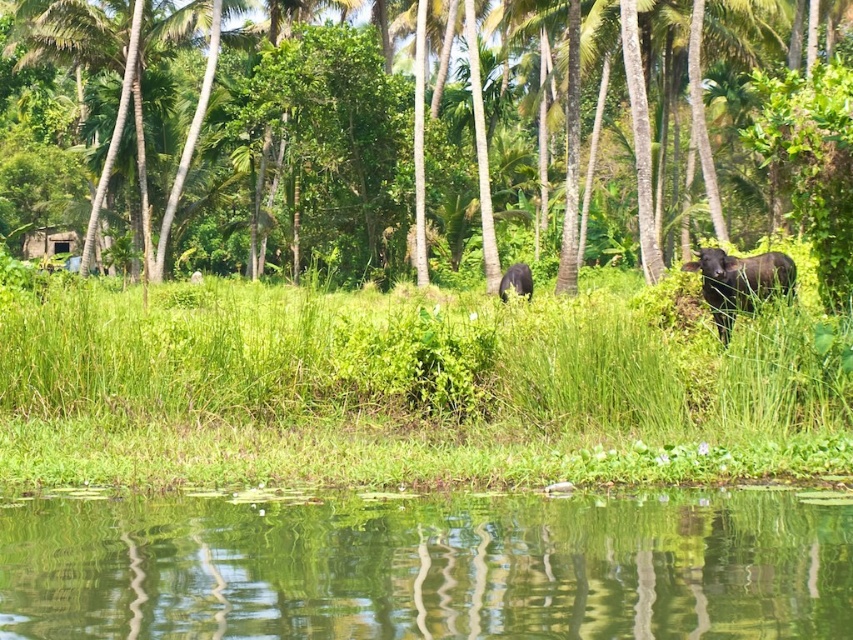
Is point (537, 28) more distant than point (570, 474)?

Yes, point (537, 28) is farther from viewer.

I want to click on green leafy tree at center, so click(424, 134).

Does green leafy tree at center have a lesser width compared to black matte cow at right?

Incorrect, green leafy tree at center's width is not less than black matte cow at right's.

Which is behind, point (289, 161) or point (767, 260)?

Point (289, 161)

Where is `green leafy tree at center`? green leafy tree at center is located at coordinates (424, 134).

Is point (225, 468) positioned in front of point (514, 264)?

That is True.

Is green grass at center above black matte cow at center?

No, green grass at center is not above black matte cow at center.

Between point (410, 307) and point (498, 296), which one is positioned in front?

Point (410, 307) is more forward.

At what (x,y) coordinates should I click in order to perform the action: click on green grass at center. Please return your answer as a coordinate pair (x, y). Looking at the image, I should click on (395, 390).